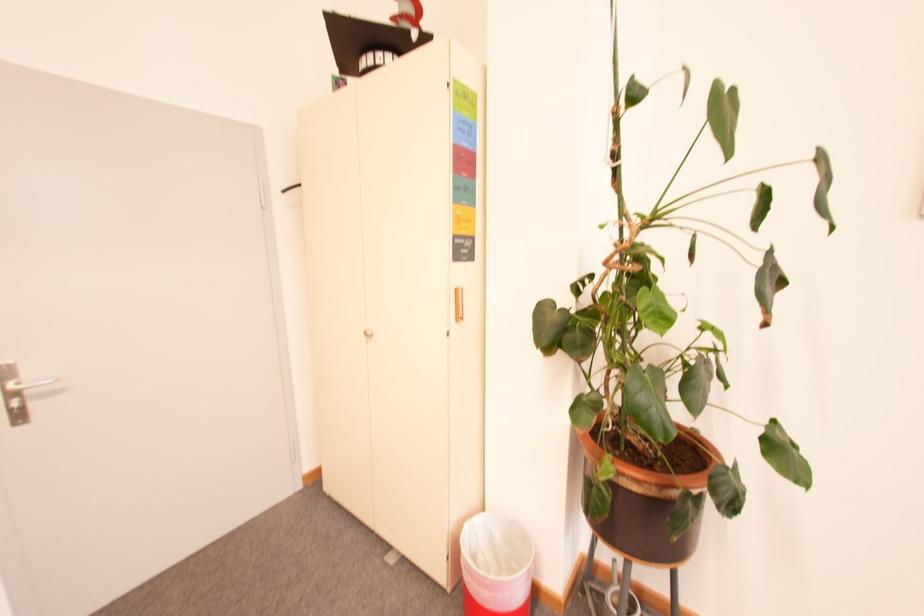
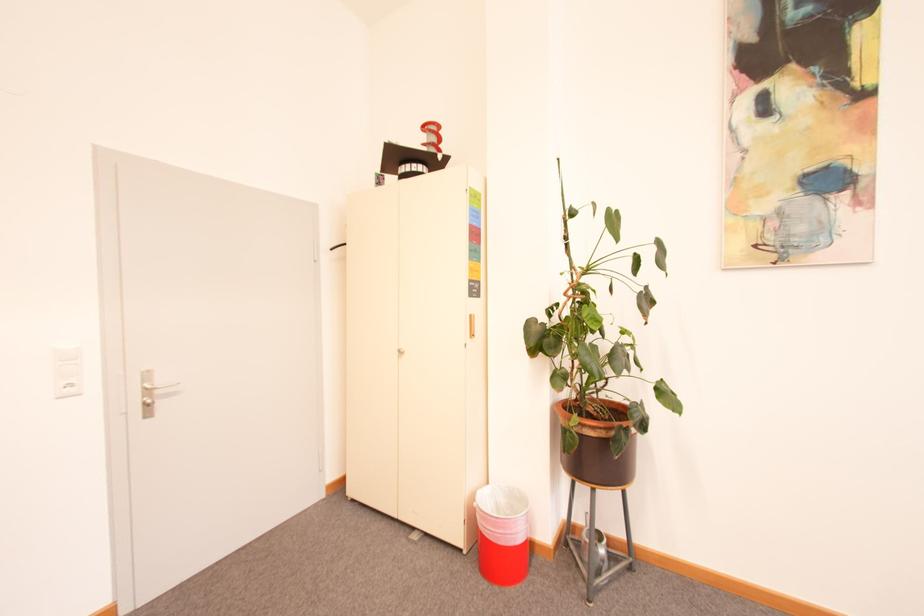
In a continuous first-person perspective shot, in which direction is the camera moving?

The cameraman moved toward left, backward.